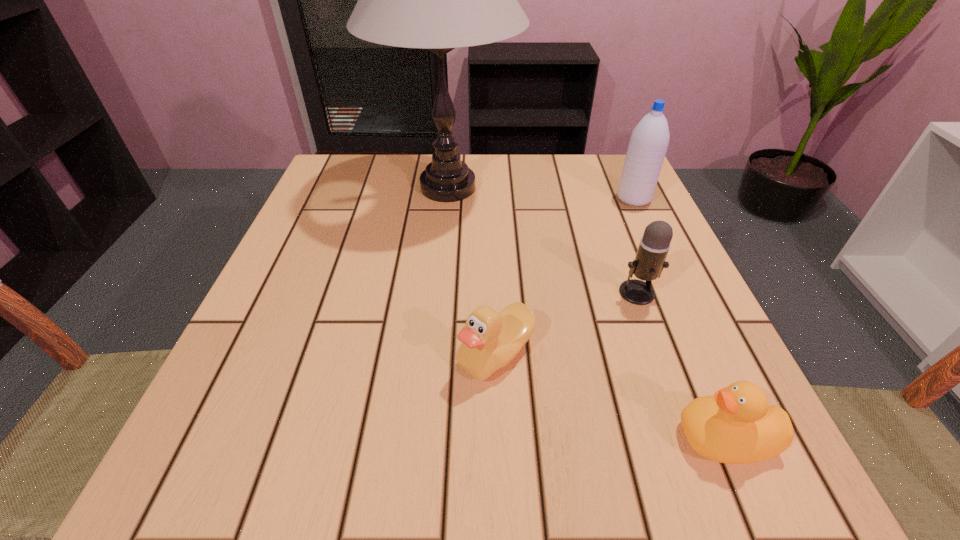
I want to click on blank region between the tallest object and the nearest object, so click(x=587, y=313).

Image resolution: width=960 pixels, height=540 pixels. Find the location of `vacant point located between the water bottle and the microphone`. vacant point located between the water bottle and the microphone is located at coordinates (636, 246).

Find the location of a particular element. vacant area that lies between the lamp and the nearer duck is located at coordinates (587, 313).

Find the location of a particular element. This screenshot has width=960, height=540. the closest object relative to the nearest object is located at coordinates (490, 340).

Select which object is the second closest to the third farthest object. Please provide its 2D coordinates. Your answer should be formatted as a tuple, i.e. [(x, y)], where the tuple contains the x and y coordinates of a point satisfying the conditions above.

[(736, 425)]

You are a GUI agent. You are given a task and a screenshot of the screen. Output one action in this format:
    pyautogui.click(x=<x>, y=<y>)
    Task: Click on the free space that satisfies the following two spatial constraints: 1. on the front side of the water bottle; 2. at the beak of the left duck
    The width and height of the screenshot is (960, 540).
    Given the screenshot: What is the action you would take?
    pyautogui.click(x=706, y=354)